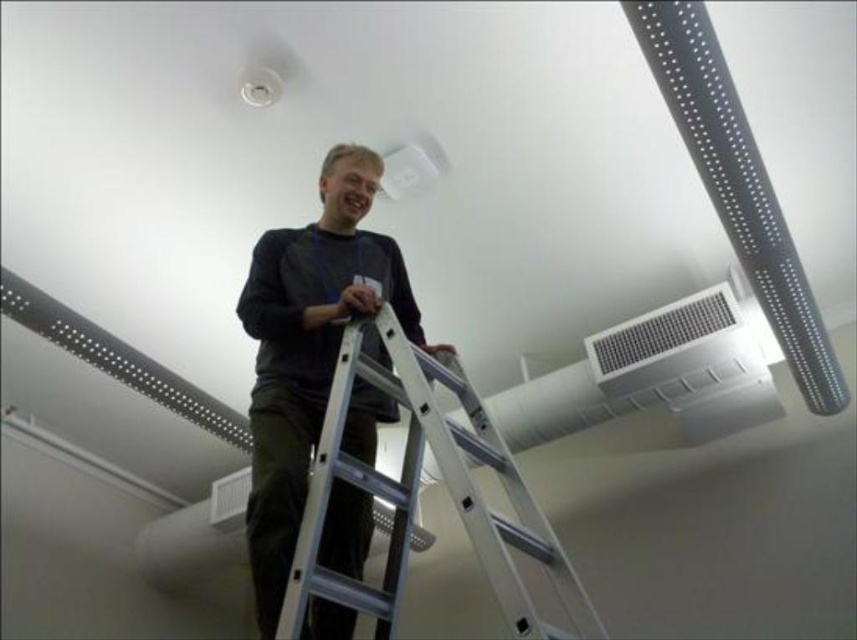
Can you confirm if silver metallic ladder at center is positioned to the right of metallic silver air conditioning at upper center?

Incorrect, silver metallic ladder at center is not on the right side of metallic silver air conditioning at upper center.

Is silver metallic ladder at center taller than metallic silver air conditioning at upper center?

Yes.

Find the location of `silver metallic ladder at center`. silver metallic ladder at center is located at coordinates (417, 493).

What do you see at coordinates (309, 349) in the screenshot?
I see `dark gray matte shirt at center` at bounding box center [309, 349].

Is dark gray matte shirt at center wider than silver metallic ladder at center?

No.

Does point (258, 337) come closer to viewer compared to point (472, 419)?

No, (258, 337) is further to viewer.

At what (x,y) coordinates should I click in order to perform the action: click on dark gray matte shirt at center. Please return your answer as a coordinate pair (x, y). This screenshot has width=857, height=640. Looking at the image, I should click on (309, 349).

Does dark gray matte shirt at center appear on the left side of metallic silver air conditioning at upper center?

Yes, dark gray matte shirt at center is to the left of metallic silver air conditioning at upper center.

How distant is dark gray matte shirt at center from metallic silver air conditioning at upper center?

dark gray matte shirt at center and metallic silver air conditioning at upper center are 1.31 meters apart from each other.

Is point (310, 300) positioned before point (622, 368)?

Yes.

I want to click on dark gray matte shirt at center, so click(309, 349).